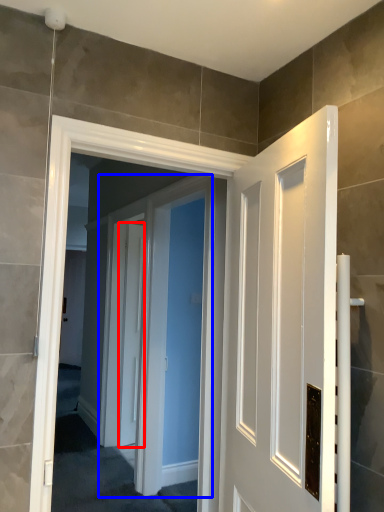
Question: Which object is closer to the camera taking this photo, door (highlighted by a red box) or screen door (highlighted by a blue box)?

Choices:
 (A) door
 (B) screen door

Answer: (B)